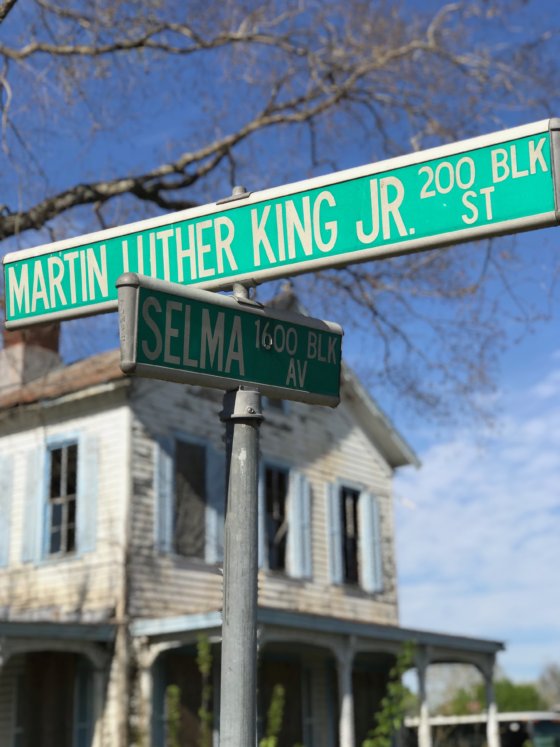
Locate an element on the screen. door is located at coordinates (292, 707).